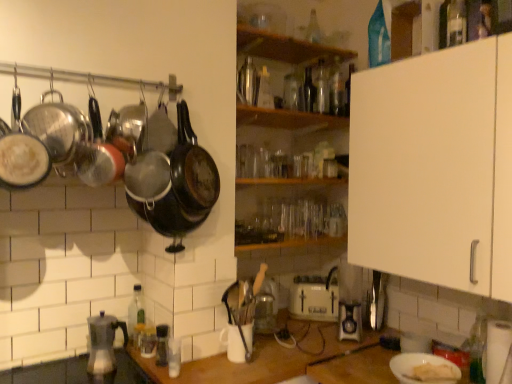
Locate an element on the screen. The height and width of the screenshot is (384, 512). vacant area located to the right-hand side of black plastic pepper grinder at lower left, which is the 3th appliance from front to back is located at coordinates (202, 361).